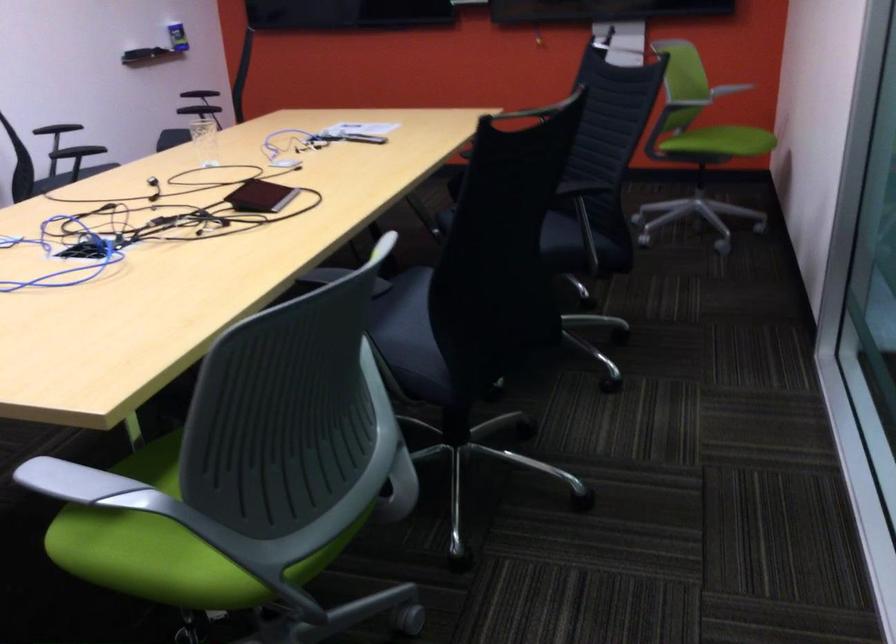
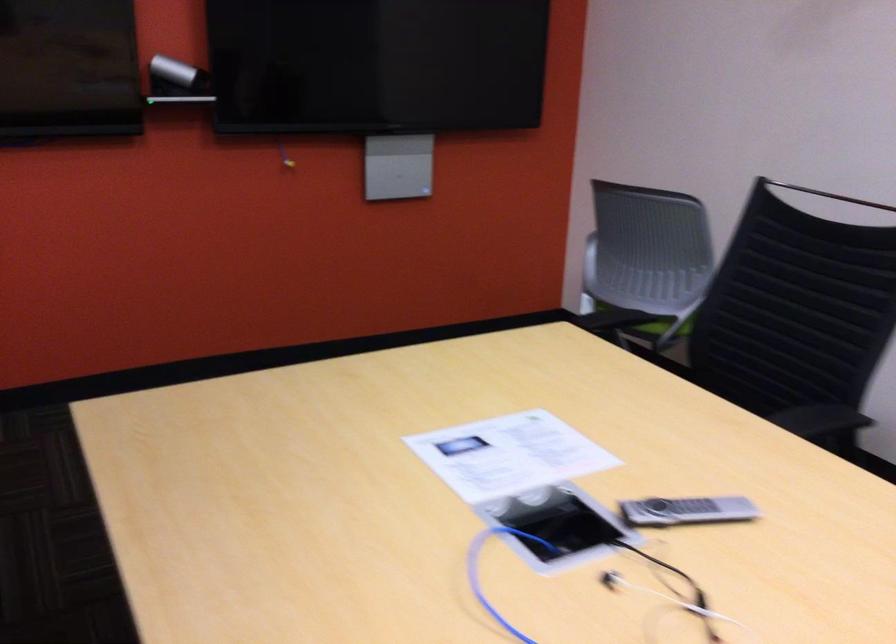
The point at (676, 147) is marked in the first image. Where is the corresponding point in the second image?

(653, 325)